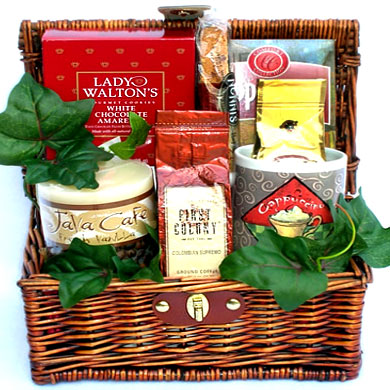
The height and width of the screenshot is (390, 390). Identify the location of inside upper lid of basket. (339, 104), (38, 71).